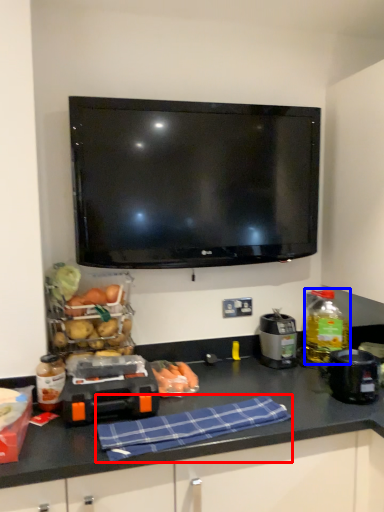
Question: Which object is further to the camera taking this photo, cloth (highlighted by a red box) or bottle (highlighted by a blue box)?

Choices:
 (A) cloth
 (B) bottle

Answer: (B)